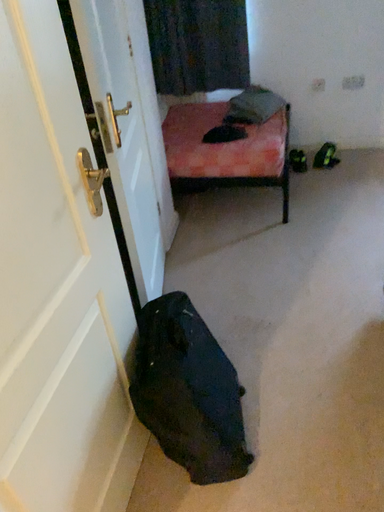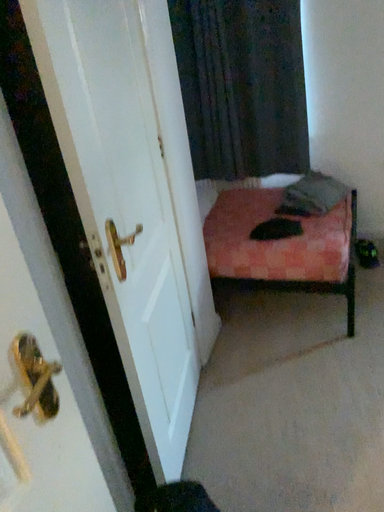
Question: Which way did the camera rotate in the video?

Choices:
 (A) rotated left
 (B) rotated right

Answer: (A)